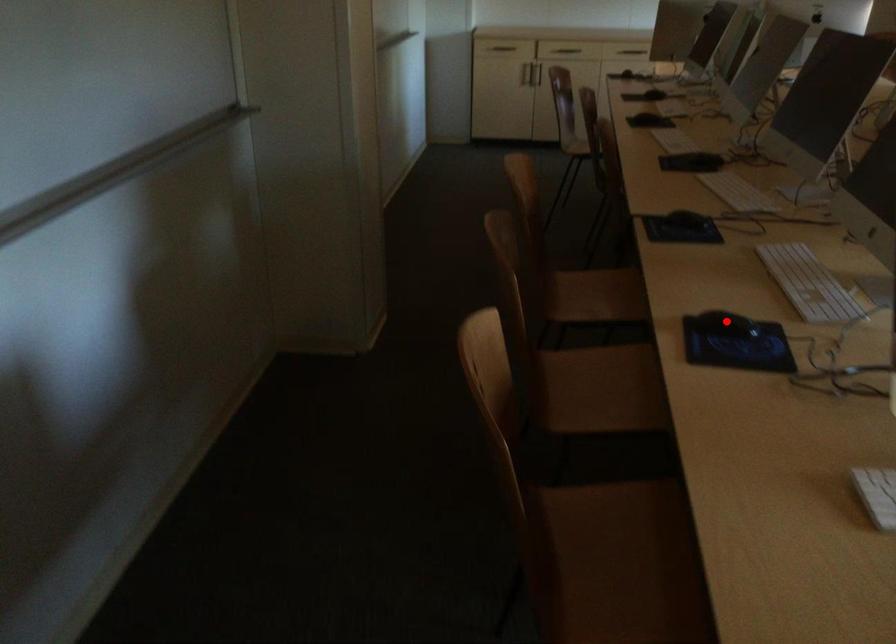
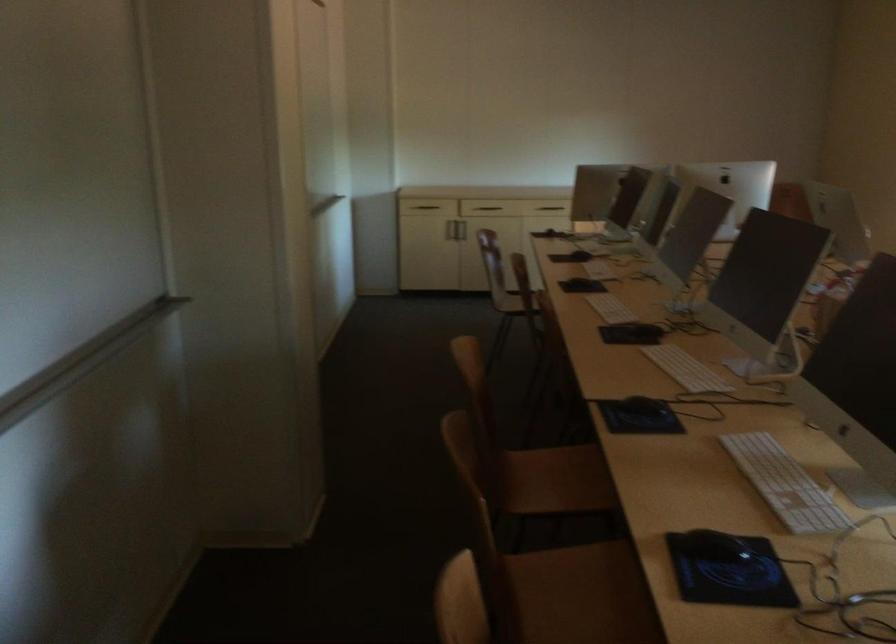
Where in the second image is the point corresponding to the highlighted location from the first image?

(713, 545)